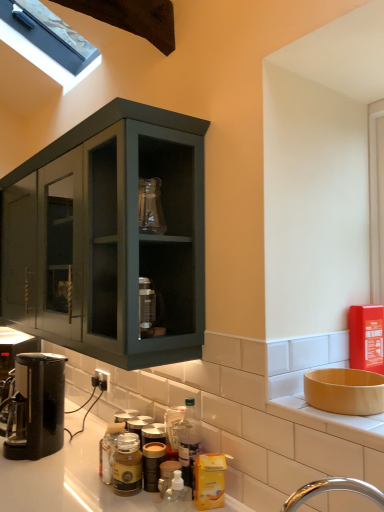
Question: From a real-world perspective, is black plastic coffee machine at lower left, arranged as the second coffee machine when viewed from the left, below matte yellow bowl at right?

Choices:
 (A) no
 (B) yes

Answer: (B)

Question: Is black plastic coffee machine at lower left, acting as the first coffee machine starting from the right, not near matte yellow bowl at right?

Choices:
 (A) no
 (B) yes

Answer: (B)

Question: From the image's perspective, does black plastic coffee machine at lower left, arranged as the 2th coffee machine when viewed from the back, appear lower than matte yellow bowl at right?

Choices:
 (A) yes
 (B) no

Answer: (A)

Question: Is black plastic coffee machine at lower left, acting as the first coffee machine starting from the right, smaller than matte yellow bowl at right?

Choices:
 (A) yes
 (B) no

Answer: (B)

Question: Are black plastic coffee machine at lower left, acting as the first coffee machine starting from the right, and matte yellow bowl at right making contact?

Choices:
 (A) no
 (B) yes

Answer: (A)

Question: From the image's perspective, is black plastic coffee machine at lower left, acting as the first coffee machine starting from the right, on top of matte yellow bowl at right?

Choices:
 (A) yes
 (B) no

Answer: (B)

Question: Is matte yellow bowl at right placed right next to yellow plastic bottle at lower center, the third bottle when ordered from back to front?

Choices:
 (A) yes
 (B) no

Answer: (B)

Question: Can we say matte yellow bowl at right lies outside yellow plastic bottle at lower center, the third bottle when ordered from back to front?

Choices:
 (A) yes
 (B) no

Answer: (A)

Question: Is matte yellow bowl at right oriented away from yellow plastic bottle at lower center, which is counted as the first bottle, starting from the right?

Choices:
 (A) yes
 (B) no

Answer: (B)

Question: Can you confirm if matte yellow bowl at right is positioned to the right of yellow plastic bottle at lower center, the third bottle when ordered from back to front?

Choices:
 (A) no
 (B) yes

Answer: (B)

Question: Is matte yellow bowl at right facing towards yellow plastic bottle at lower center, positioned as the fourth bottle in left-to-right order?

Choices:
 (A) no
 (B) yes

Answer: (A)

Question: From the image's perspective, does matte yellow bowl at right appear higher than yellow plastic bottle at lower center, positioned as the fourth bottle in left-to-right order?

Choices:
 (A) no
 (B) yes

Answer: (B)

Question: From the image's perspective, is black plastic coffee machine at lower left, the second coffee machine positioned from the front, over translucent plastic bottle at lower center, placed as the 4th bottle when sorted from front to back?

Choices:
 (A) no
 (B) yes

Answer: (A)